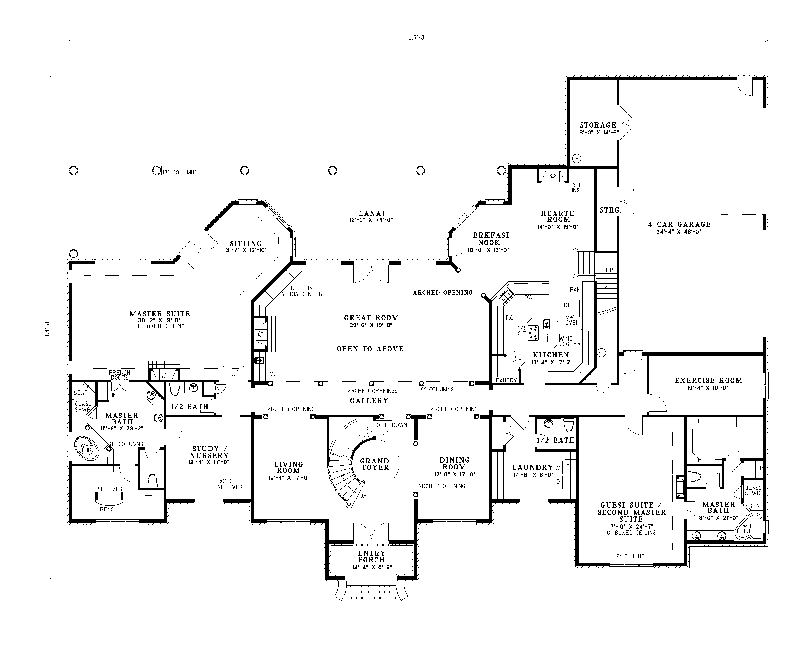
Identify the location of dining room. Image resolution: width=800 pixels, height=671 pixels. (417, 419), (420, 517), (488, 516), (485, 417).